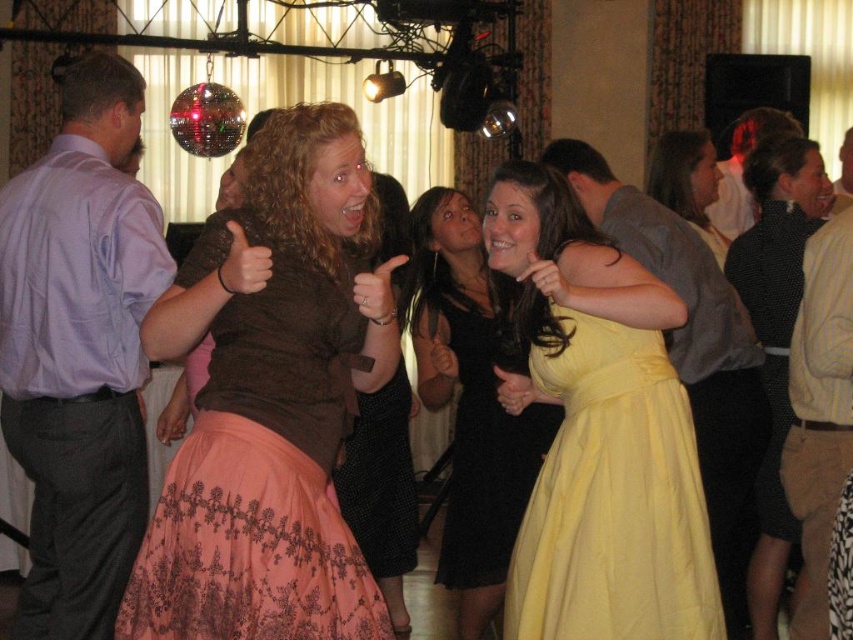
Question: Which object appears closest to the camera in this image?

Choices:
 (A) light brown hair at upper right
 (B) light purple shirt at left

Answer: (B)

Question: Which point is farther to the camera?

Choices:
 (A) yellow satin dress at center
 (B) matte brown blouse at center

Answer: (A)

Question: Can you confirm if light brown leather pants at right is positioned above brown fuzzy sweater at center?

Choices:
 (A) no
 (B) yes

Answer: (B)

Question: Is brown fuzzy sweater at center wider than light brown hair at upper right?

Choices:
 (A) no
 (B) yes

Answer: (A)

Question: Among these points, which one is nearest to the camera?

Choices:
 (A) (512, 593)
 (B) (225, 465)
 (C) (718, 161)
 (D) (137, 301)

Answer: (B)

Question: Is light purple shirt at left positioned before brown fuzzy sweater at center?

Choices:
 (A) no
 (B) yes

Answer: (B)